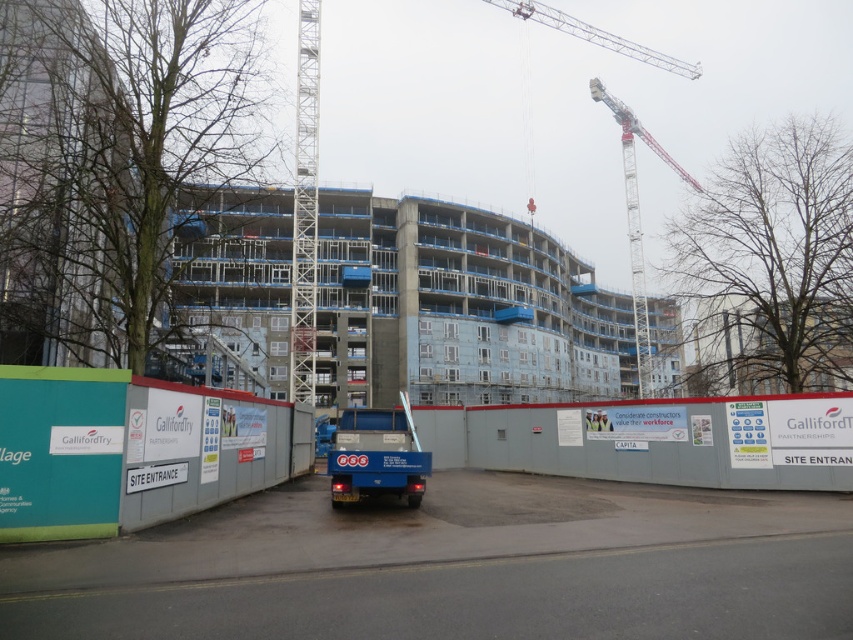
You are a delivery driver approaching the construction site. You need to drop off materials at the white metal crane at upper right. According to the coordinates provided, where exactly should you position your vehicle to deliver the materials?

The white metal crane at upper right is located at coordinates point (636, 225). Position your vehicle near this coordinate to deliver the materials.

You are a construction worker who needs to move a heavy beam from the white metal crane at upper right to the concrete wall at center. Which direction should you move the beam to place it correctly?

The concrete wall at center is to the left of the white metal crane at upper right, so you should move the beam to the left to place it correctly.

You are a construction worker who needs to move a heavy beam from the ground to the second floor of the concrete building at center. The white metal crane at upper right is available. Can you use the crane to lift the beam to the building?

The concrete building at center is closer to the viewer than the white metal crane at upper right. Since the crane is positioned further away, it may not have sufficient reach to lift the beam directly to the building. Consider checking the crane operator for the best approach.